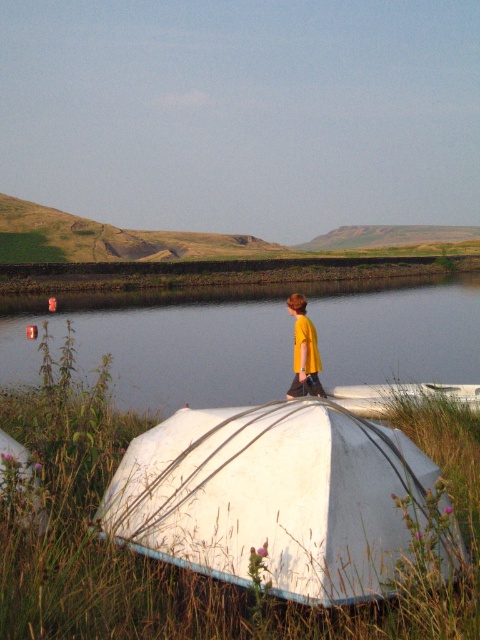
You are standing at the edge of the water and want to reach the white fabric boat at lower center. The distance between you and the boat is 11.80 feet. If you can walk 3 feet per second, how many seconds will it take you to reach the boat?

The distance between you and the white fabric boat at lower center is 11.80 feet. At a walking speed of 3 feet per second, it will take approximately 3.93 seconds to reach the boat.

You are a hiker who wants to cross the water using the white fabric boat at lower center. However, you notice the yellow fabric shirt at center is blocking the path to the boat. Can you reach the boat without moving the shirt?

→ The white fabric boat at lower center is positioned on the left side of yellow fabric shirt at center, so the shirt is blocking the path. You would need to move the shirt to access the boat.